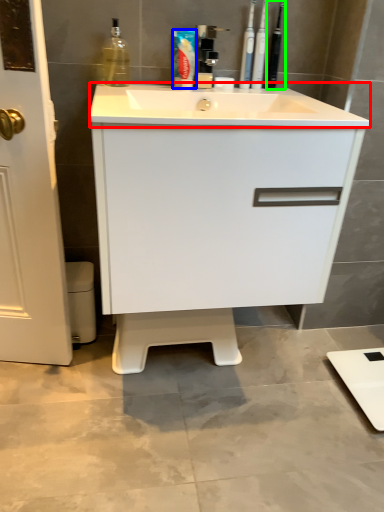
Question: Considering the real-world distances, which object is closest to counter top (highlighted by a red box)? toothpaste (highlighted by a blue box) or toiletry (highlighted by a green box).

Choices:
 (A) toothpaste
 (B) toiletry

Answer: (A)